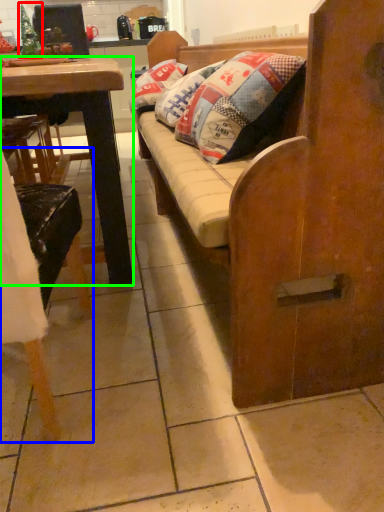
Question: Considering the real-world distances, which object is farthest from christmas tree (highlighted by a red box)? chair (highlighted by a blue box) or desk (highlighted by a green box)?

Choices:
 (A) chair
 (B) desk

Answer: (A)